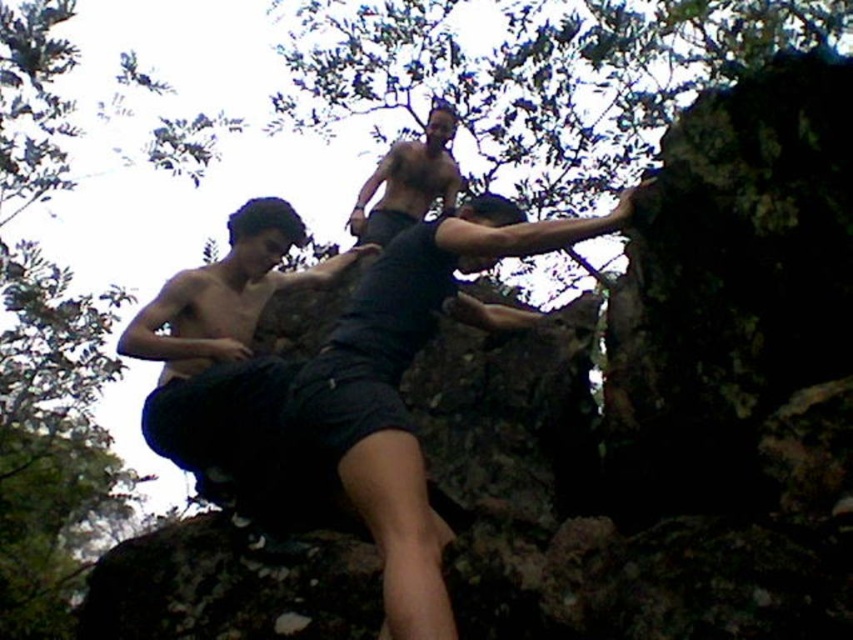
Between dark gray shorts at center and dark matte shorts at left, which one has more height?

dark matte shorts at left is taller.

Based on the photo, who is more distant from viewer, (374,340) or (267,536)?

Positioned behind is point (267,536).

The image size is (853, 640). Identify the location of dark gray shorts at center. (399, 381).

Is dark matte shorts at left thinner than shiny black shorts at upper center?

Incorrect, dark matte shorts at left's width is not less than shiny black shorts at upper center's.

Between dark matte shorts at left and shiny black shorts at upper center, which one has less height?

With less height is dark matte shorts at left.

Does point (270, 442) come in front of point (436, 125)?

Yes, it is.

The height and width of the screenshot is (640, 853). In order to click on dark matte shorts at left in this screenshot , I will do `click(225, 365)`.

Who is taller, dark gray shorts at center or shiny black shorts at upper center?

shiny black shorts at upper center is taller.

Which is in front, point (506, 230) or point (422, 144)?

Point (506, 230)

Is point (413, 449) in front of point (393, 186)?

Yes, point (413, 449) is in front of point (393, 186).

At what (x,y) coordinates should I click in order to perform the action: click on dark gray shorts at center. Please return your answer as a coordinate pair (x, y). Image resolution: width=853 pixels, height=640 pixels. Looking at the image, I should click on (399, 381).